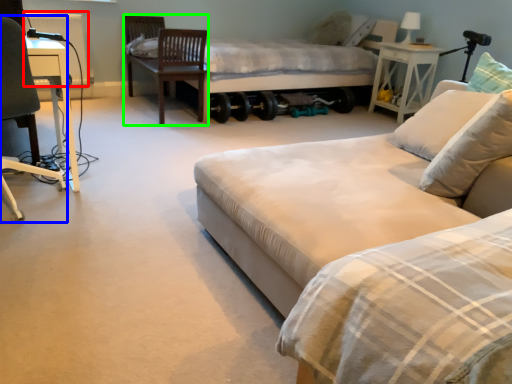
Question: Considering the real-world distances, which object is farthest from radiator (highlighted by a red box)? chair (highlighted by a blue box) or swivel chair (highlighted by a green box)?

Choices:
 (A) chair
 (B) swivel chair

Answer: (A)